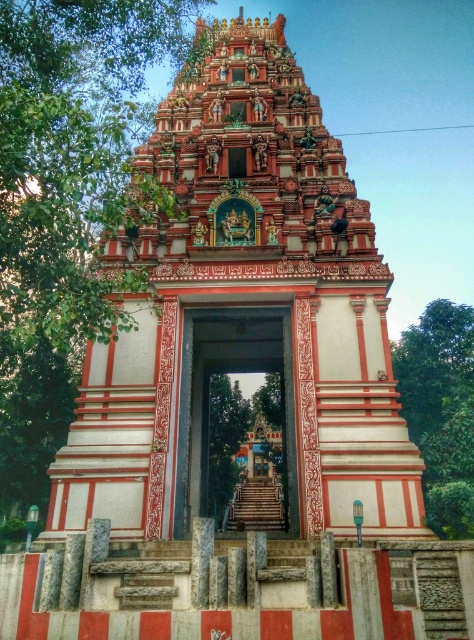
Question: In this image, where is polished stone temple at center located relative to polished stone gate at center?

Choices:
 (A) left
 (B) right

Answer: (A)

Question: Which point is closer to the camera?

Choices:
 (A) (248, 356)
 (B) (240, 337)

Answer: (B)

Question: Is polished stone temple at center to the right of polished stone gate at center from the viewer's perspective?

Choices:
 (A) no
 (B) yes

Answer: (A)

Question: Among these points, which one is farthest from the camera?

Choices:
 (A) (110, 364)
 (B) (198, 387)

Answer: (B)

Question: Does polished stone temple at center have a lesser width compared to polished stone gate at center?

Choices:
 (A) no
 (B) yes

Answer: (A)